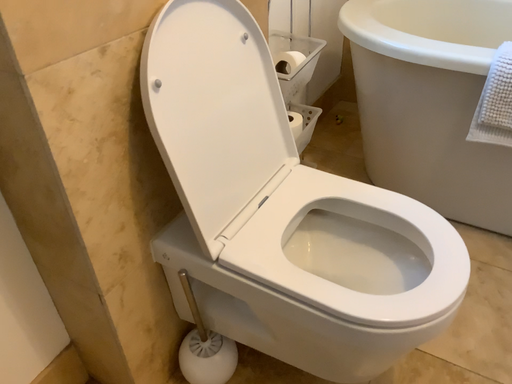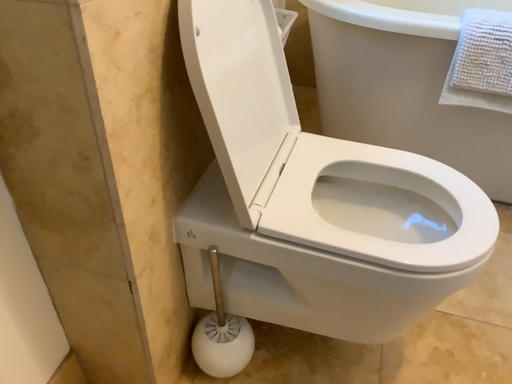
Question: How did the camera likely rotate when shooting the video?

Choices:
 (A) rotated left
 (B) rotated right

Answer: (B)